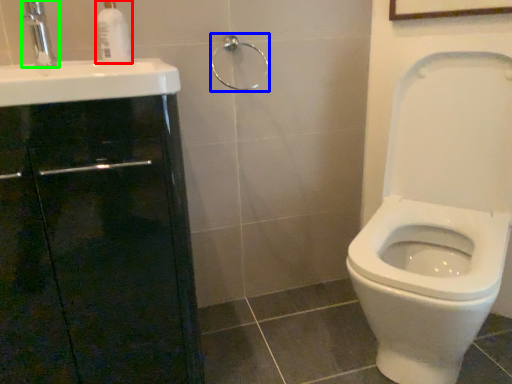
Question: Which object is the closest to the soap dispenser (highlighted by a red box)? Choose among these: shower (highlighted by a blue box) or tap (highlighted by a green box).

Choices:
 (A) shower
 (B) tap

Answer: (B)